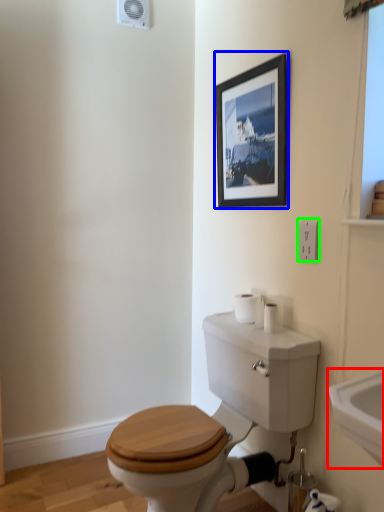
Question: Estimate the real-world distances between objects in this image. Which object is farther from sink (highlighted by a red box), picture frame (highlighted by a blue box) or electric outlet (highlighted by a green box)?

Choices:
 (A) picture frame
 (B) electric outlet

Answer: (A)